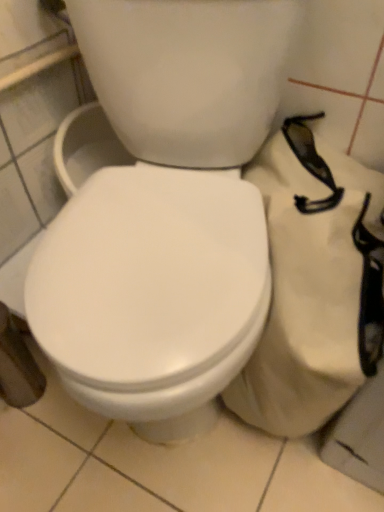
Image resolution: width=384 pixels, height=512 pixels. Describe the element at coordinates (313, 285) in the screenshot. I see `black rubber sunglasses at right` at that location.

Identify the location of black rubber sunglasses at right. (313, 285).

Locate an element on the screen. Image resolution: width=384 pixels, height=512 pixels. black rubber sunglasses at right is located at coordinates (313, 285).